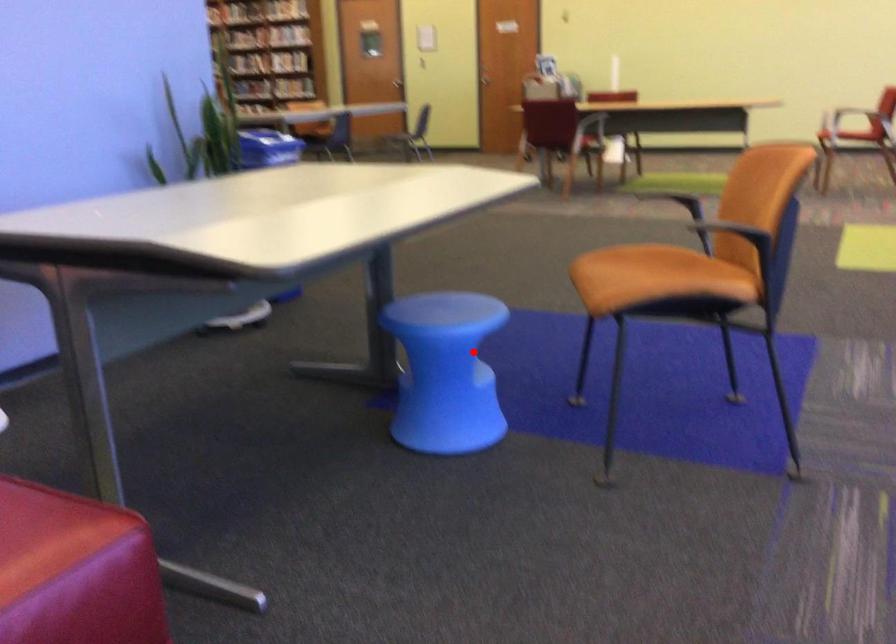
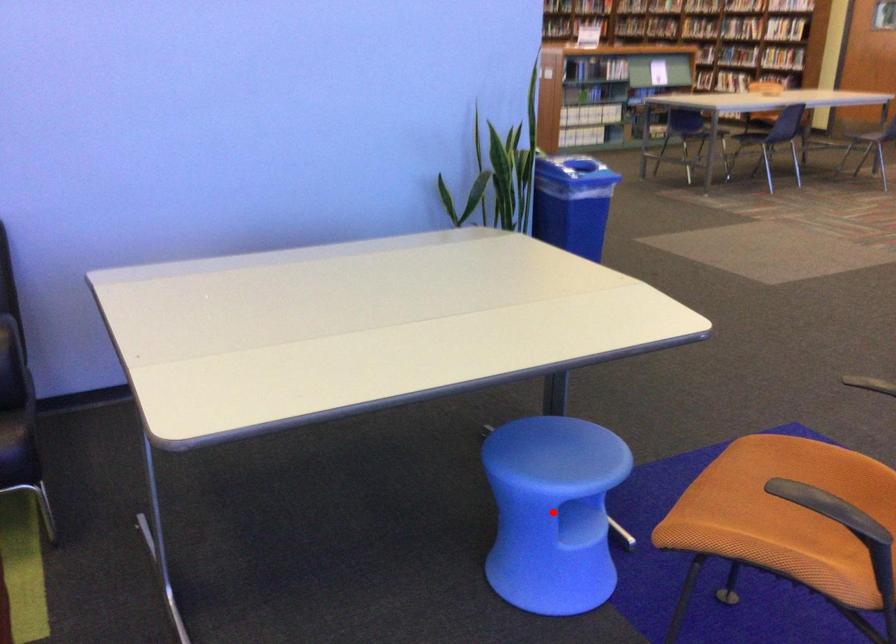
I am providing you with two images of the same scene from different viewpoints. A red point is marked on the first image and another point is marked on the second image. Is the marked point in image1 the same physical position as the marked point in image2?

Yes